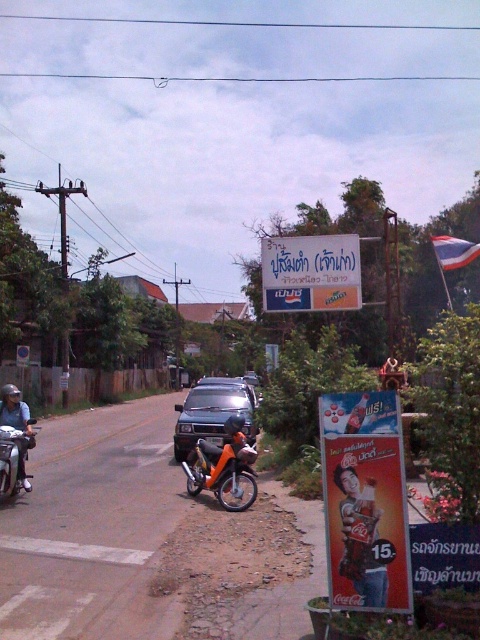
Question: Can you confirm if metallic gray car at center is positioned to the left of orange matte motorcycle at center?

Choices:
 (A) no
 (B) yes

Answer: (B)

Question: Which point is farther to the camera?

Choices:
 (A) (10, 465)
 (B) (348, 532)
 (C) (230, 458)
 (D) (205, 380)

Answer: (D)

Question: Which point is closer to the camera?

Choices:
 (A) smooth plastic coca-cola sign at lower right
 (B) metallic gray car at center
 (C) matte black motorcycle at left
 (D) orange matte motorcycle at center

Answer: (A)

Question: Is smooth plastic coca-cola sign at lower right to the right of matte black motorcycle at left from the viewer's perspective?

Choices:
 (A) no
 (B) yes

Answer: (B)

Question: Which point is closer to the camera?

Choices:
 (A) (188, 451)
 (B) (351, 472)

Answer: (B)

Question: Is smooth plastic coca-cola sign at lower right to the right of metallic gray car at center from the viewer's perspective?

Choices:
 (A) yes
 (B) no

Answer: (A)